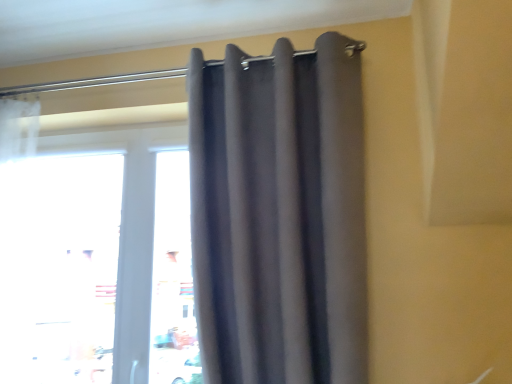
What do you see at coordinates (96, 260) in the screenshot? The image size is (512, 384). I see `transparent glass window at center` at bounding box center [96, 260].

Identify the location of transparent glass window at center. The image size is (512, 384). (96, 260).

Locate an element on the screen. This screenshot has height=384, width=512. dark gray fabric curtain at upper center is located at coordinates (279, 213).

The height and width of the screenshot is (384, 512). Describe the element at coordinates (279, 213) in the screenshot. I see `dark gray fabric curtain at upper center` at that location.

Identify the location of transparent glass window at center. The width and height of the screenshot is (512, 384). (96, 260).

Between transparent glass window at center and dark gray fabric curtain at upper center, which one appears on the left side from the viewer's perspective?

transparent glass window at center is more to the left.

Is transparent glass window at center positioned behind dark gray fabric curtain at upper center?

Yes, the depth of transparent glass window at center is greater than that of dark gray fabric curtain at upper center.

Which is in front, point (120, 310) or point (342, 122)?

The point (342, 122) is more forward.

From the image's perspective, does transparent glass window at center appear lower than dark gray fabric curtain at upper center?

Result: Correct, transparent glass window at center appears lower than dark gray fabric curtain at upper center in the image.

From a real-world perspective, is transparent glass window at center under dark gray fabric curtain at upper center?

Yes, from a real-world perspective, transparent glass window at center is below dark gray fabric curtain at upper center.

In terms of width, does transparent glass window at center look wider or thinner when compared to dark gray fabric curtain at upper center?

Clearly, transparent glass window at center has less width compared to dark gray fabric curtain at upper center.

Between transparent glass window at center and dark gray fabric curtain at upper center, which one has more height?

With more height is dark gray fabric curtain at upper center.

Does transparent glass window at center have a smaller size compared to dark gray fabric curtain at upper center?

Correct, transparent glass window at center occupies less space than dark gray fabric curtain at upper center.

Can dark gray fabric curtain at upper center be found inside transparent glass window at center?

No, dark gray fabric curtain at upper center is not a part of transparent glass window at center.

Is transparent glass window at center not near dark gray fabric curtain at upper center?

No, transparent glass window at center is not far away from dark gray fabric curtain at upper center.

Based on the photo, could you tell me if transparent glass window at center is facing dark gray fabric curtain at upper center?

No, transparent glass window at center is not oriented towards dark gray fabric curtain at upper center.

Identify the location of curtain above the transparent glass window at center (from the image's perspective). The width and height of the screenshot is (512, 384). (279, 213).

Looking at this image, is dark gray fabric curtain at upper center to the left or to the right of transparent glass window at center in the image?

In the image, dark gray fabric curtain at upper center appears on the right side of transparent glass window at center.

Is dark gray fabric curtain at upper center positioned behind transparent glass window at center?

No, dark gray fabric curtain at upper center is closer to the viewer.

Which is less distant, (276, 335) or (137, 154)?

The point (276, 335) is closer to the camera.

From the image's perspective, between dark gray fabric curtain at upper center and transparent glass window at center, who is located below?

transparent glass window at center, from the image's perspective.

From a real-world perspective, relative to transparent glass window at center, is dark gray fabric curtain at upper center vertically above or below?

dark gray fabric curtain at upper center is above transparent glass window at center.

Considering the relative sizes of dark gray fabric curtain at upper center and transparent glass window at center in the image provided, is dark gray fabric curtain at upper center wider than transparent glass window at center?

Correct, the width of dark gray fabric curtain at upper center exceeds that of transparent glass window at center.

Does dark gray fabric curtain at upper center have a lesser height compared to transparent glass window at center?

No.

Considering the relative sizes of dark gray fabric curtain at upper center and transparent glass window at center in the image provided, is dark gray fabric curtain at upper center smaller than transparent glass window at center?

No.

Is dark gray fabric curtain at upper center inside or outside of transparent glass window at center?

dark gray fabric curtain at upper center lies outside transparent glass window at center.

Is dark gray fabric curtain at upper center next to transparent glass window at center and touching it?

No, dark gray fabric curtain at upper center is not with transparent glass window at center.

Is transparent glass window at center at the back of dark gray fabric curtain at upper center?

No, dark gray fabric curtain at upper center is not facing away from transparent glass window at center.

The image size is (512, 384). In the image, there is a dark gray fabric curtain at upper center. What are the coordinates of `window below it (from a real-world perspective)` in the screenshot? It's located at (96, 260).

In order to click on window behind the dark gray fabric curtain at upper center in this screenshot , I will do `click(96, 260)`.

You are a GUI agent. You are given a task and a screenshot of the screen. Output one action in this format:
    pyautogui.click(x=<x>, y=<y>)
    Task: Click on the curtain in front of the transparent glass window at center
    This screenshot has width=512, height=384.
    Given the screenshot: What is the action you would take?
    pyautogui.click(x=279, y=213)